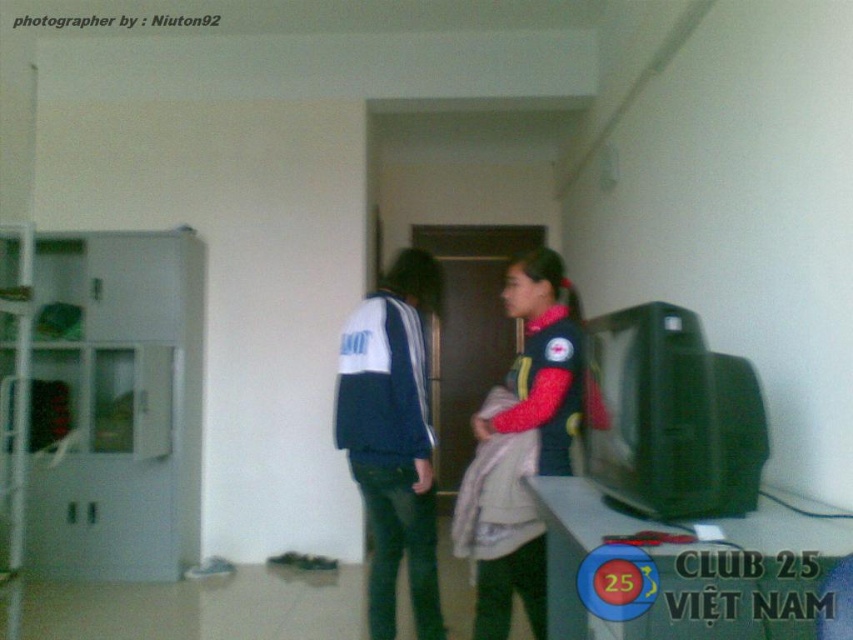
Can you confirm if blue fleece jacket at center is smaller than velvet-like red jacket at center?

Incorrect, blue fleece jacket at center is not smaller in size than velvet-like red jacket at center.

Which is more to the left, blue fleece jacket at center or velvet-like red jacket at center?

Positioned to the left is blue fleece jacket at center.

Is point (426, 445) positioned before point (537, 428)?

No.

The width and height of the screenshot is (853, 640). What are the coordinates of `blue fleece jacket at center` in the screenshot? It's located at (393, 436).